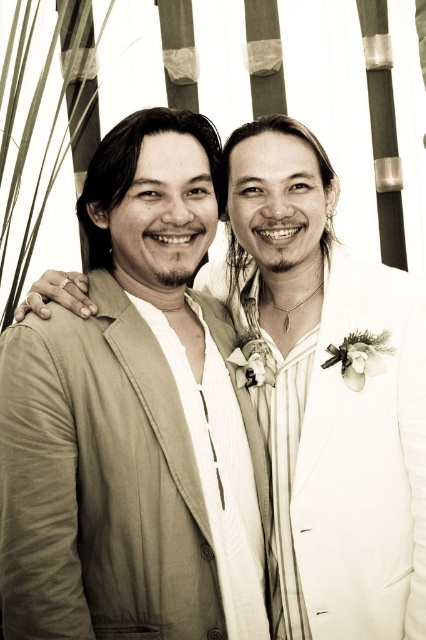
You are a photographer adjusting your camera settings to focus on the light beige fabric business suit at left. What are the coordinates you should input into your camera to ensure proper focus?

The coordinates to focus on the light beige fabric business suit at left are at point [100,484].

You are attending a wedding and need to determine the seating arrangement based on the image provided. The bride is wearing the white satin suit at right. Which side of the aisle should the light beige fabric business suit at left be seated on, relative to the bride?

The light beige fabric business suit at left should be seated to the left of the bride since it is positioned to the left of the white satin suit at right in the image.

You are a photographer adjusting your camera settings to focus on the subjects in the image. Since you want to ensure both the light beige fabric business suit at left and the white satin suit at right are in focus, which subject should you prioritize focusing on first to achieve proper depth of field?

You should focus on the light beige fabric business suit at left first because it is closer to the viewer, and adjusting the depth of field from the closer subject outward increases the likelihood of both being in focus.